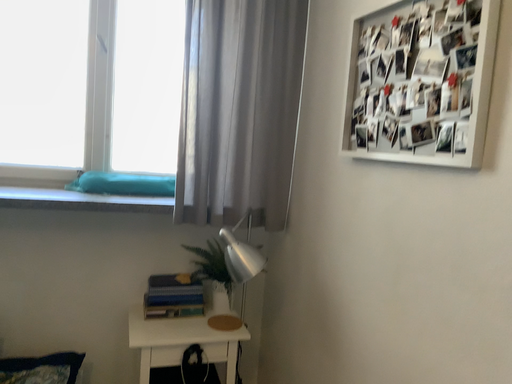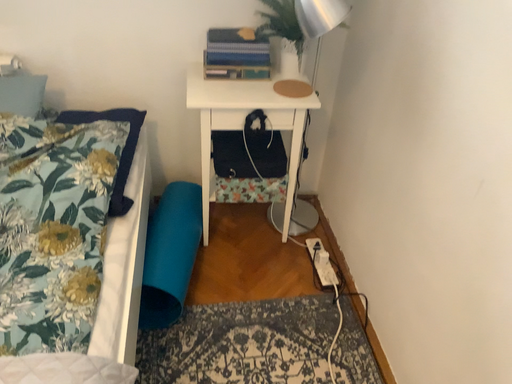
Question: How did the camera likely rotate when shooting the video?

Choices:
 (A) rotated right
 (B) rotated left

Answer: (B)